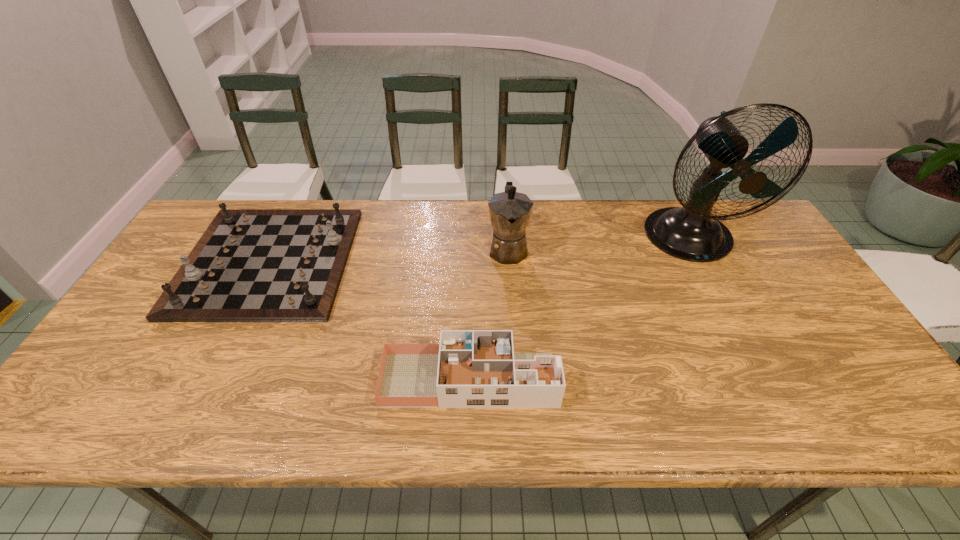
Where is `coffeepot positioned at the far edge`? This screenshot has height=540, width=960. coffeepot positioned at the far edge is located at coordinates (510, 211).

Locate an element on the screen. chessboard present at the far edge is located at coordinates (251, 265).

Locate an element on the screen. The width and height of the screenshot is (960, 540). object that is at the near edge is located at coordinates (469, 368).

Identify the location of object at the left edge. (251, 265).

Identify the location of object present at the right edge. The image size is (960, 540). (690, 233).

Where is `object located at the far left corner`? object located at the far left corner is located at coordinates (251, 265).

The image size is (960, 540). Identify the location of object that is at the far right corner. (690, 233).

At what (x,y) coordinates should I click in order to perform the action: click on vacant area at the far edge. Please return your answer as a coordinate pair (x, y). Looking at the image, I should click on (484, 222).

Find the location of a particular element. free spot at the near edge of the desktop is located at coordinates (148, 420).

Where is `vacant space at the left edge of the desktop`? vacant space at the left edge of the desktop is located at coordinates (172, 340).